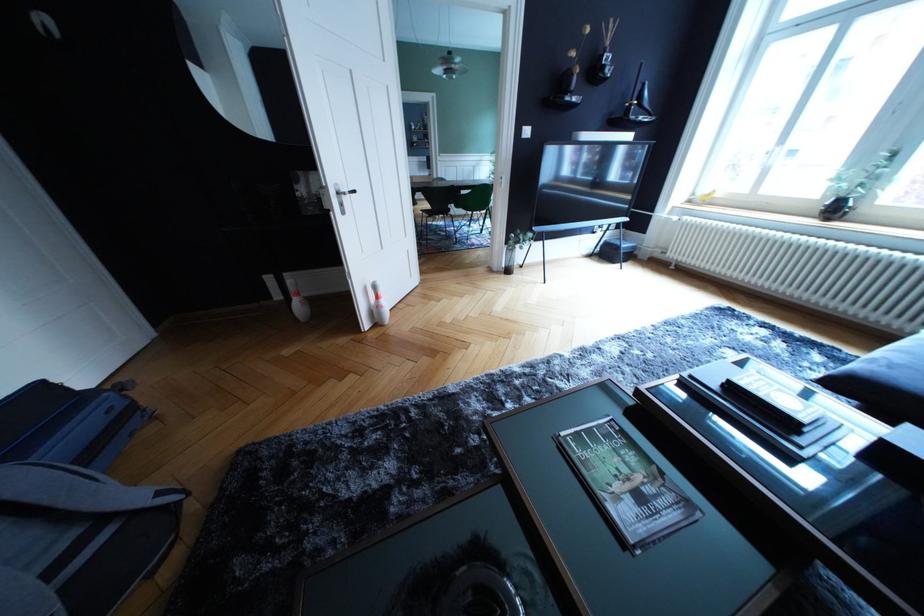
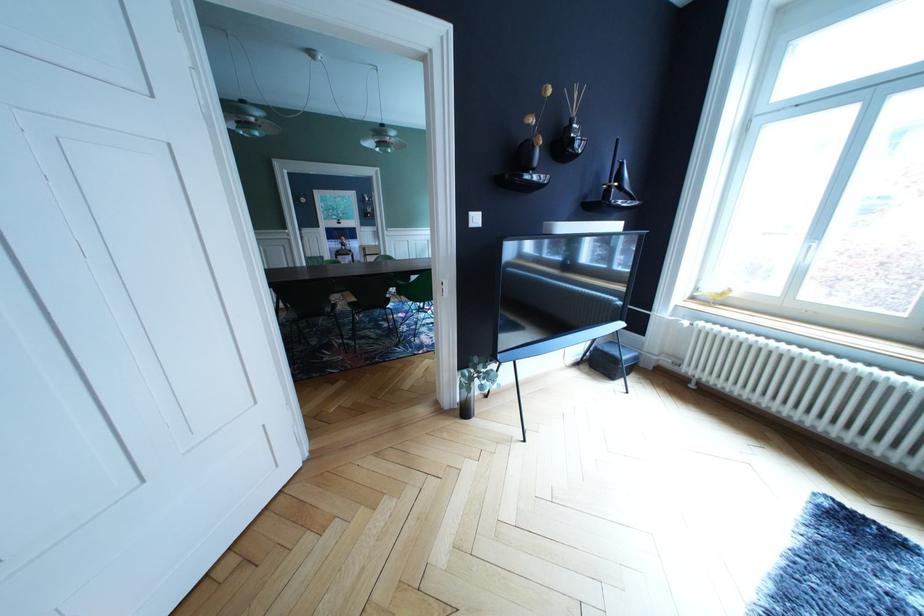
In the second image, find the point that corresponds to (626,254) in the first image.

(625, 367)